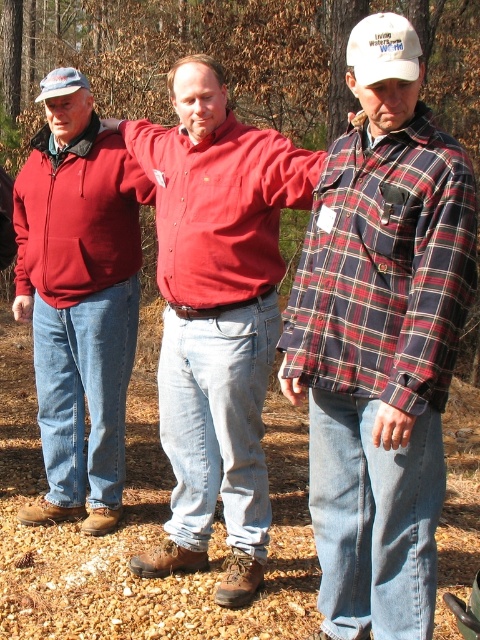
Does matte red shirt at center have a smaller size compared to matte red jacket at left?

Incorrect, matte red shirt at center is not smaller in size than matte red jacket at left.

The image size is (480, 640). Describe the element at coordinates (216, 314) in the screenshot. I see `matte red shirt at center` at that location.

Locate an element on the screen. matte red shirt at center is located at coordinates (216, 314).

Is point (215, 300) positioned before point (41, 83)?

Yes.

Locate an element on the screen. This screenshot has width=480, height=640. matte red shirt at center is located at coordinates (x=216, y=314).

What do you see at coordinates (216, 314) in the screenshot? I see `matte red shirt at center` at bounding box center [216, 314].

Find the location of `matte red shirt at center`. matte red shirt at center is located at coordinates (216, 314).

Who is more forward, (373,76) or (43,99)?

Point (373,76) is in front.

Which is behind, point (417, 74) or point (60, 74)?

The point (60, 74) is behind.

The width and height of the screenshot is (480, 640). What are the coordinates of `white cotton cap at upper right` in the screenshot? It's located at (383, 49).